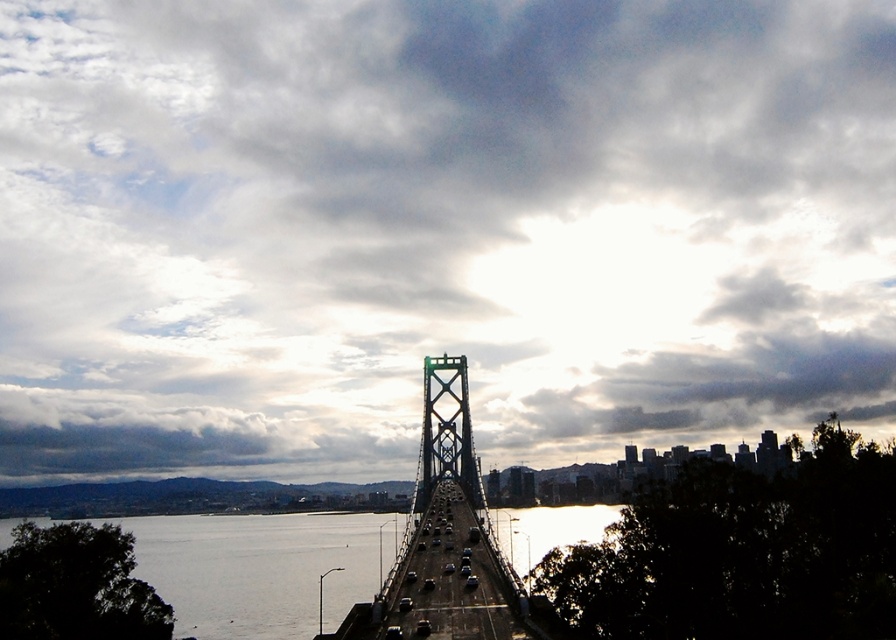
You are a photographer planning to capture the reflection of the green metallic suspension bridge at center in the silvery water at center. Based on the scene, can you determine if the reflection will be fully visible in the water?

The silvery water at center has a larger size compared to green metallic suspension bridge at center, so the reflection of the green metallic suspension bridge at center will be fully visible in the silvery water at center.

You are standing on the suspension bridge looking towards the city skyline. You notice two points marked on the bridge. One is at point coordinates point (208, 524) and the other at point (431, 593). Which point is closer to you as you stand on the bridge facing the city?

Point (208, 524) is further to the camera than point (431, 593). Therefore, the point closer to you is point (431, 593).

You are a photographer standing on a hill overlooking the silvery water at center and the green metallic suspension bridge at center. You want to take a photo that captures both the water and the bridge. Which object should you focus on first to ensure both are in frame?

The silvery water at center is further to the viewer than the green metallic suspension bridge at center, so you should focus on the green metallic suspension bridge at center first to ensure both are in frame.